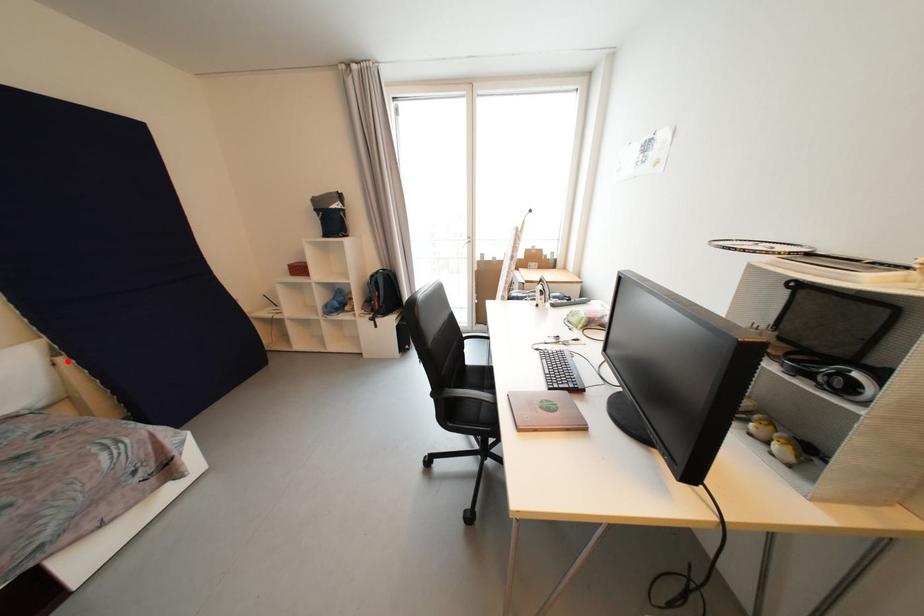
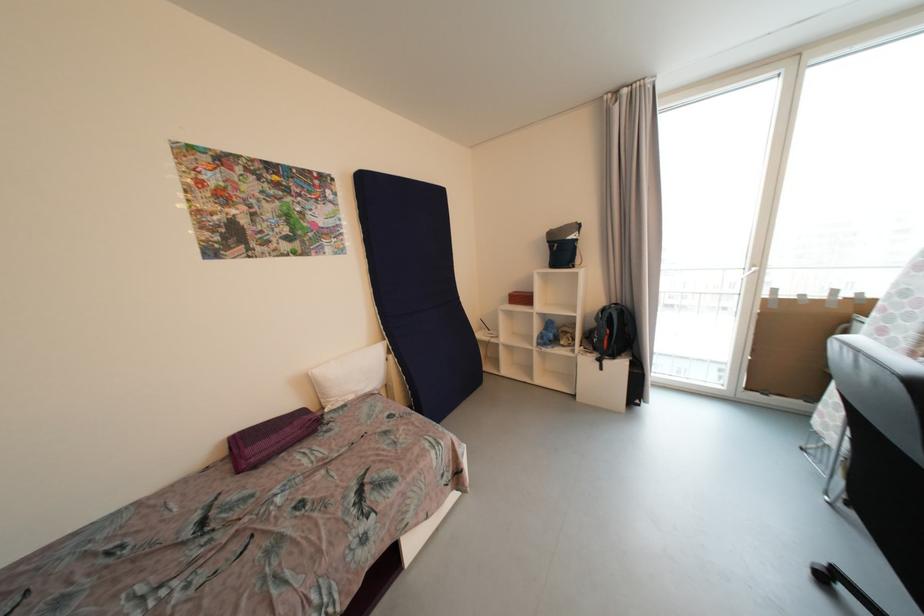
Question: A red point is marked in image1. In image2, is the corresponding 3D point closer to the camera or farther? Reply with the corresponding letter.

Choices:
 (A) The corresponding 3D point is closer.
 (B) The corresponding 3D point is farther.

Answer: (B)